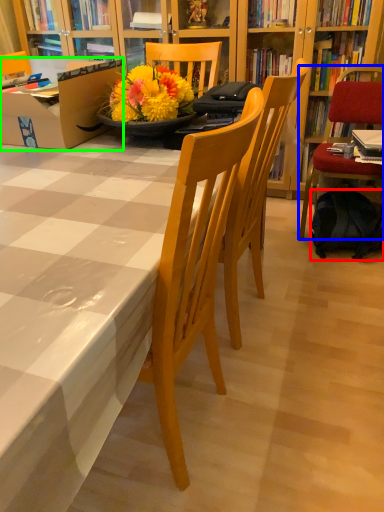
Question: Estimate the real-world distances between objects in this image. Which object is closer to backpack (highlighted by a red box), chair (highlighted by a blue box) or box (highlighted by a green box)?

Choices:
 (A) chair
 (B) box

Answer: (A)